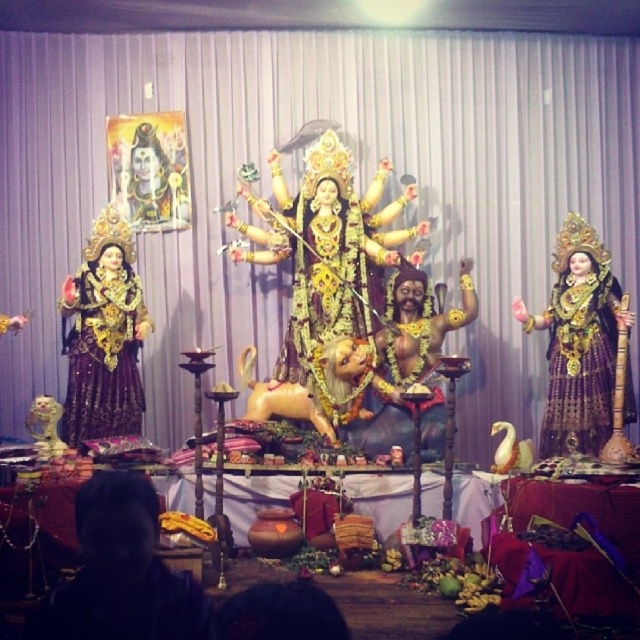
Between dark fabric headscarf at lower left and golden painted portrait at upper left, which one has less height?

dark fabric headscarf at lower left is shorter.

Does dark fabric headscarf at lower left have a lesser width compared to golden painted portrait at upper left?

Indeed, dark fabric headscarf at lower left has a lesser width compared to golden painted portrait at upper left.

Describe the element at coordinates (120, 572) in the screenshot. I see `dark fabric headscarf at lower left` at that location.

Where is `dark fabric headscarf at lower left`? The width and height of the screenshot is (640, 640). dark fabric headscarf at lower left is located at coordinates (120, 572).

The width and height of the screenshot is (640, 640). Describe the element at coordinates (326, 269) in the screenshot. I see `gold/golden statue at center` at that location.

Between gold/golden statue at center and golden painted portrait at upper left, which one is positioned lower?

Positioned lower is gold/golden statue at center.

Which is behind, point (340, 256) or point (129, 177)?

The point (129, 177) is behind.

I want to click on gold/golden statue at center, so [326, 269].

This screenshot has width=640, height=640. Find the location of `dark fabric headscarf at lower left`. dark fabric headscarf at lower left is located at coordinates (120, 572).

Who is more distant from viewer, (104, 512) or (76, 412)?

The point (76, 412) is more distant.

Find the location of a particular element. dark fabric headscarf at lower left is located at coordinates click(x=120, y=572).